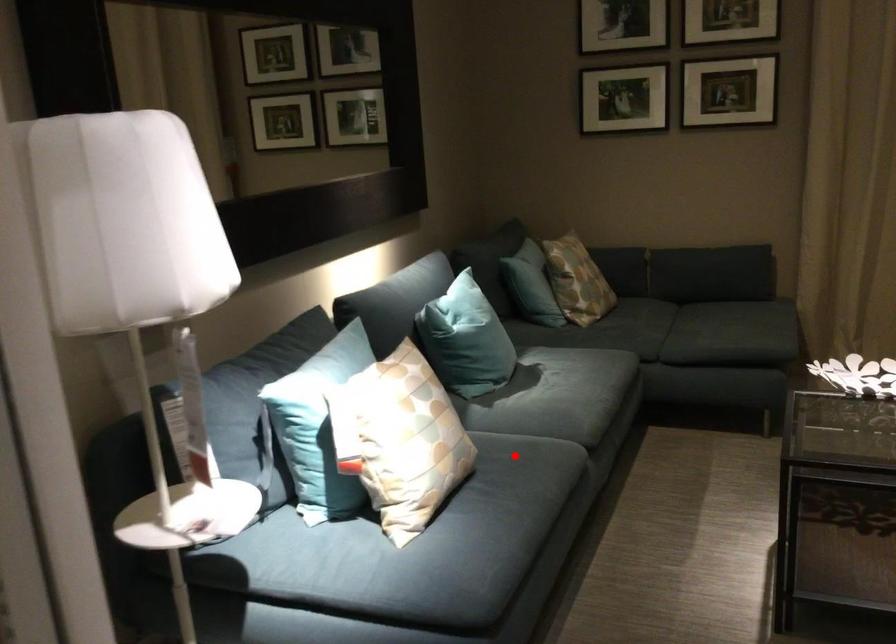
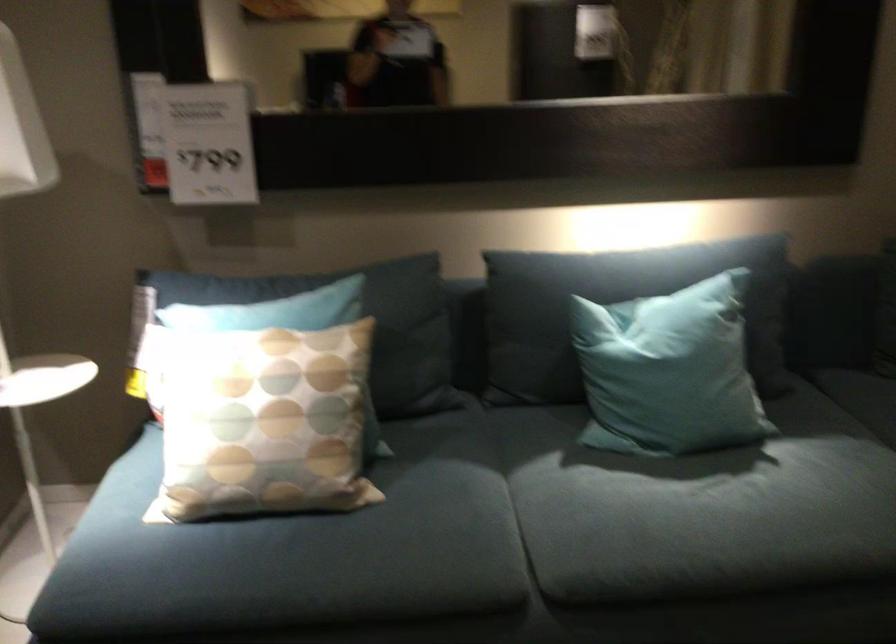
Question: I am providing you with two images of the same scene from different viewpoints. Image1 has a red point marked. In image2, the corresponding 3D location appears at what relative position? Reply with the corresponding letter.

Choices:
 (A) Closer
 (B) Farther

Answer: (A)